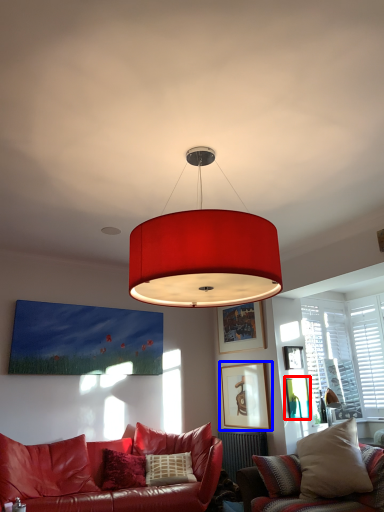
Question: Which of the following is the farthest to the observer, picture frame (highlighted by a red box) or picture frame (highlighted by a blue box)?

Choices:
 (A) picture frame
 (B) picture frame

Answer: (B)